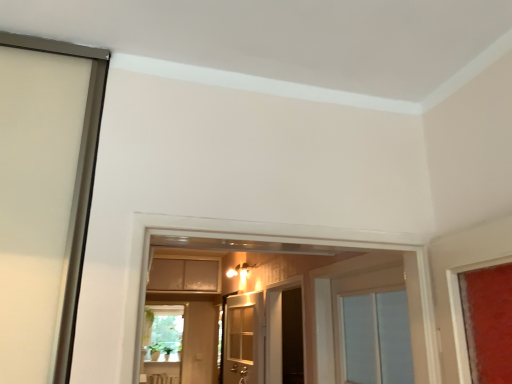
Question: Do you think matte beige cabinet at center is within white wooden door at center, or outside of it?

Choices:
 (A) inside
 (B) outside

Answer: (B)

Question: Is point (151, 268) positioned closer to the camera than point (253, 309)?

Choices:
 (A) farther
 (B) closer

Answer: (B)

Question: Based on their relative distances, which object is farther from the dark wood screen door at center?

Choices:
 (A) white wooden door at center
 (B) matte beige cabinet at center

Answer: (B)

Question: Considering the real-world distances, which object is closest to the white wooden door at center?

Choices:
 (A) matte beige cabinet at center
 (B) dark wood screen door at center

Answer: (B)